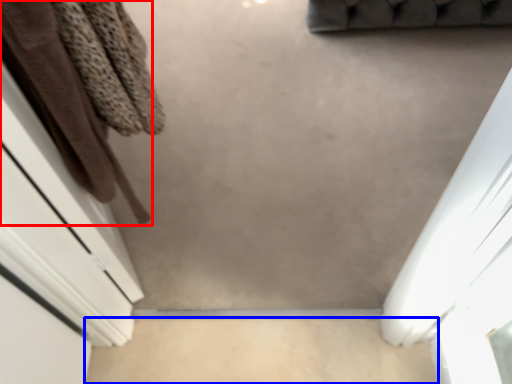
Question: Which of the following is the farthest to the observer, clothing (highlighted by a red box) or concrete (highlighted by a blue box)?

Choices:
 (A) clothing
 (B) concrete

Answer: (B)